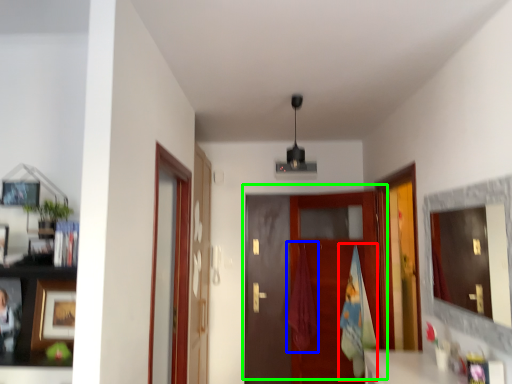
Question: Based on their relative distances, which object is farther from bath towel (highlighted by a red box)? Choose from laundry (highlighted by a blue box) and door (highlighted by a green box).

Choices:
 (A) laundry
 (B) door

Answer: (A)